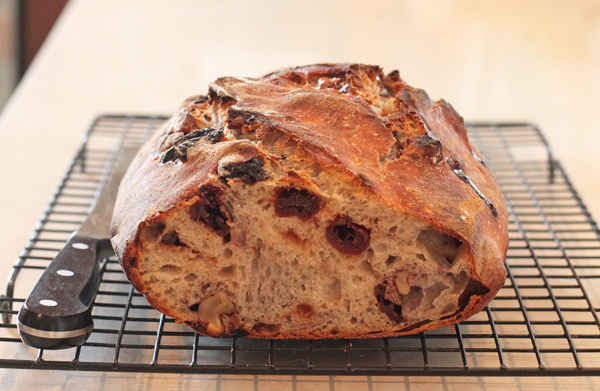
The width and height of the screenshot is (600, 391). Identify the location of handle. (69, 286).